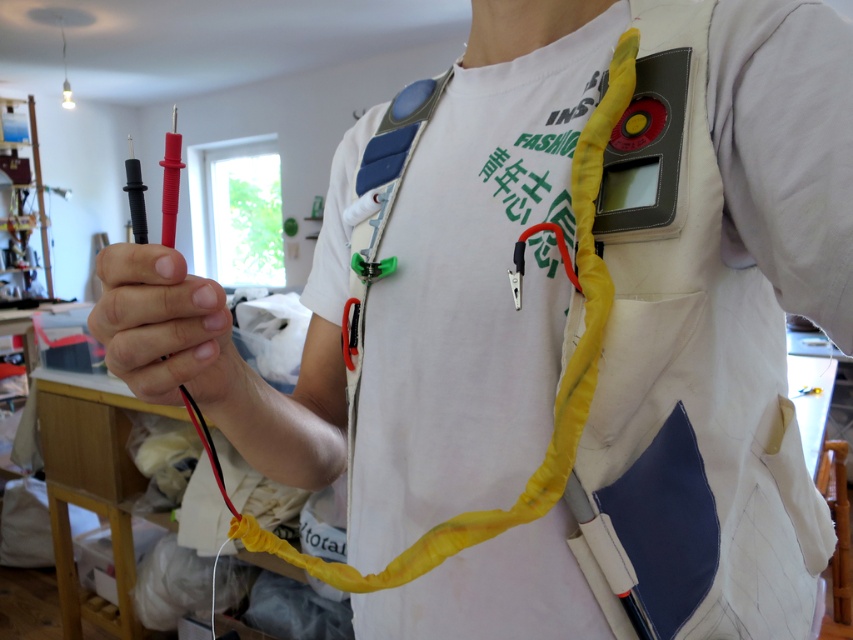
Question: Is black rubber gloves at center thinner than black plastic multimeter probe at left?

Choices:
 (A) no
 (B) yes

Answer: (B)

Question: Which of the following is the farthest from the observer?

Choices:
 (A) black rubber gloves at center
 (B) red plastic multimeter probes at left

Answer: (B)

Question: Considering the real-world distances, which object is closest to the red plastic multimeter probes at left?

Choices:
 (A) black plastic multimeter probe at left
 (B) black rubber gloves at center

Answer: (A)

Question: Which object is positioned farthest from the black plastic multimeter probe at left?

Choices:
 (A) black rubber gloves at center
 (B) red plastic multimeter probes at left

Answer: (A)

Question: Considering the relative positions of black rubber gloves at center and red plastic multimeter probes at left in the image provided, where is black rubber gloves at center located with respect to red plastic multimeter probes at left?

Choices:
 (A) below
 (B) above

Answer: (A)

Question: Does red plastic multimeter probes at left have a greater width compared to black plastic multimeter probe at left?

Choices:
 (A) no
 (B) yes

Answer: (A)